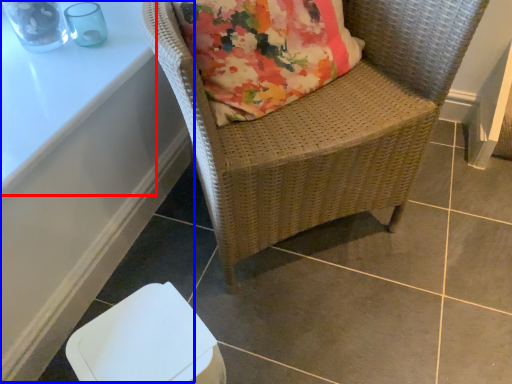
Question: Which point is closer to the camera, table (highlighted by a red box) or table (highlighted by a blue box)?

Choices:
 (A) table
 (B) table

Answer: (A)